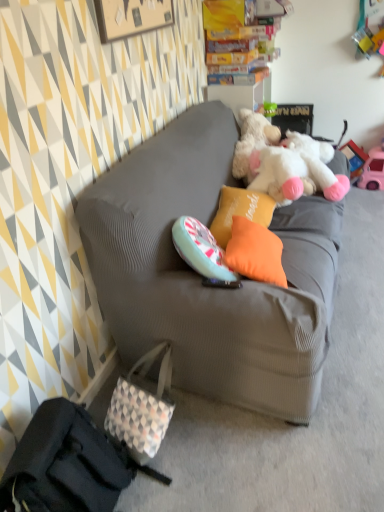
Where is `free space in front of pink plastic toy car at right`? The image size is (384, 512). free space in front of pink plastic toy car at right is located at coordinates (368, 197).